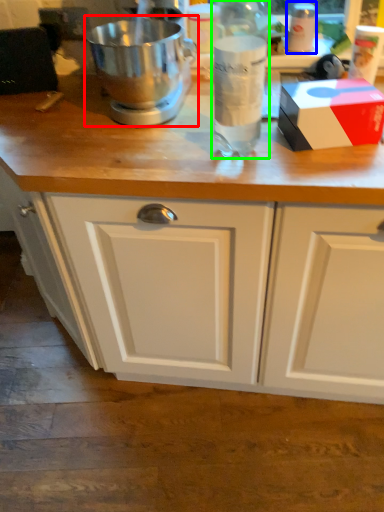
Question: Based on their relative distances, which object is nearer to mixer (highlighted by a red box)? Choose from bottle (highlighted by a blue box) and bottle (highlighted by a green box).

Choices:
 (A) bottle
 (B) bottle

Answer: (B)